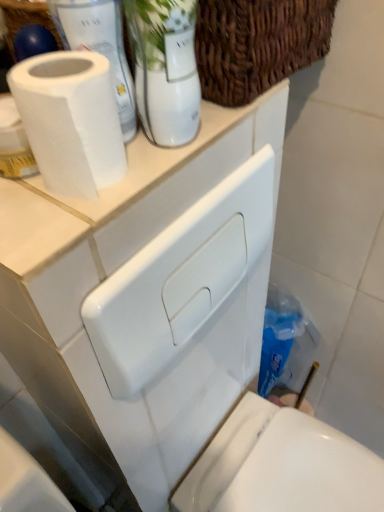
Question: From the image's perspective, relative to white matte paper towel at upper left, is white glossy glass vase at upper center above or below?

Choices:
 (A) below
 (B) above

Answer: (B)

Question: In terms of height, does white glossy glass vase at upper center look taller or shorter compared to white matte paper towel at upper left?

Choices:
 (A) tall
 (B) short

Answer: (B)

Question: Estimate the real-world distances between objects in this image. Which object is closer to the woven brown basket at upper center?

Choices:
 (A) white matte paper towel at upper left
 (B) white glossy toilet at lower right
 (C) blue plastic bottle at lower right
 (D) white matte toilet paper at upper left
 (E) white glossy glass vase at upper center

Answer: (E)

Question: Which object is positioned closest to the blue plastic bottle at lower right?

Choices:
 (A) white matte toilet paper at upper left
 (B) white matte paper towel at upper left
 (C) woven brown basket at upper center
 (D) white glossy toilet at lower right
 (E) white matte counter top at upper center

Answer: (D)